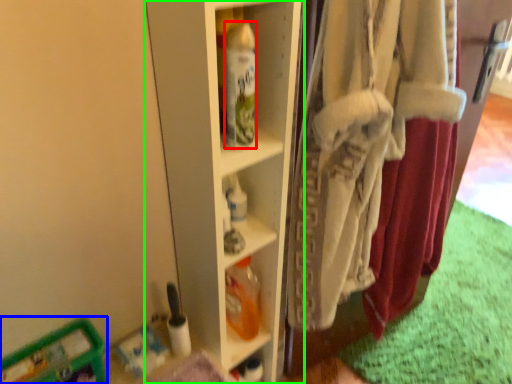
Question: Which object is positioned farthest from bottle (highlighted by a red box)? Select from wide (highlighted by a blue box) and shelf (highlighted by a green box).

Choices:
 (A) wide
 (B) shelf

Answer: (A)